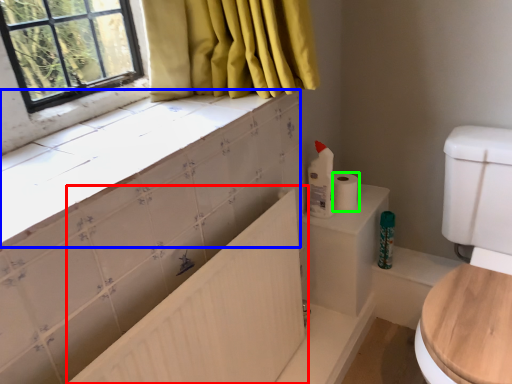
Question: Which is nearer to the bath (highlighted by a red box)? counter top (highlighted by a blue box) or toilet paper (highlighted by a green box).

Choices:
 (A) counter top
 (B) toilet paper

Answer: (A)